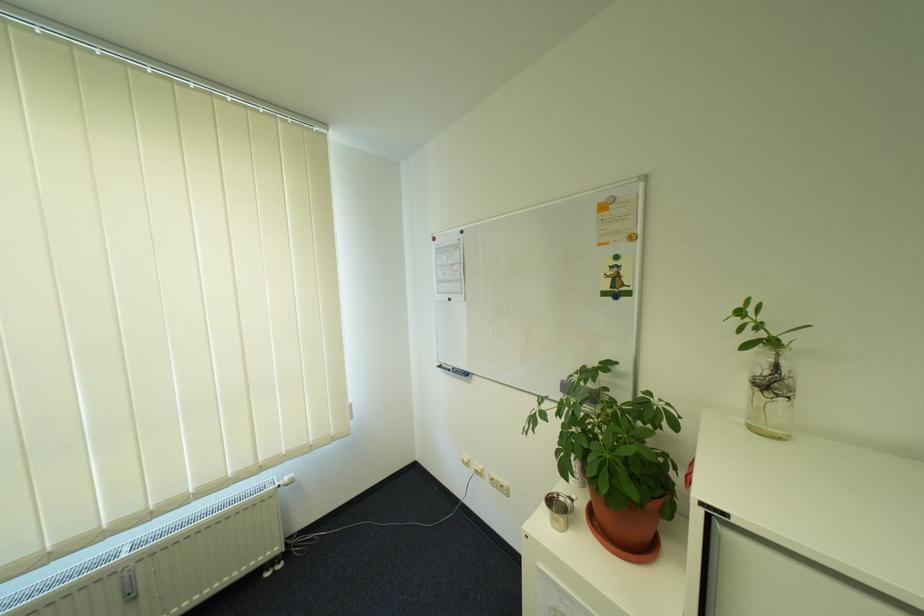
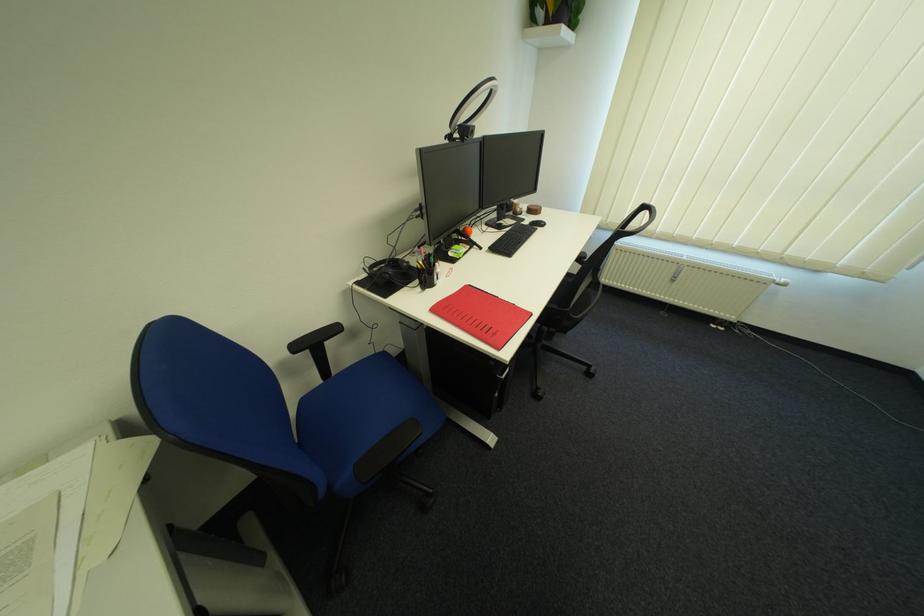
Where in the second image is the point corresponding to the point at 296,480 from the first image?

(793, 281)